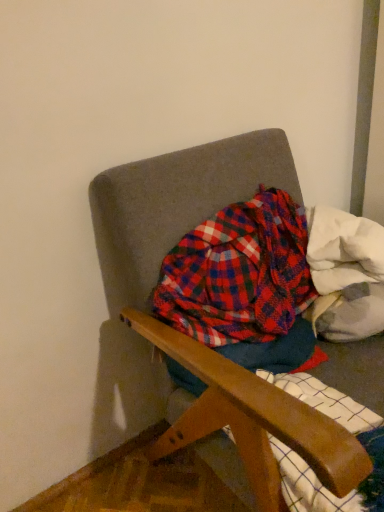
What do you see at coordinates (346, 274) in the screenshot?
I see `white fluffy blanket at upper right` at bounding box center [346, 274].

Where is `white fluffy blanket at upper right`? The height and width of the screenshot is (512, 384). white fluffy blanket at upper right is located at coordinates (346, 274).

Relative to textured fabric chair at center, is plaid fabric at center in front or behind?

Visually, plaid fabric at center is located behind textured fabric chair at center.

From the image's perspective, which one is positioned higher, plaid fabric at center or textured fabric chair at center?

plaid fabric at center, from the image's perspective.

Is plaid fabric at center bigger or smaller than textured fabric chair at center?

In the image, plaid fabric at center appears to be smaller than textured fabric chair at center.

Can you tell me how much plaid fabric at center and textured fabric chair at center differ in facing direction?

4.07 degrees separate the facing orientations of plaid fabric at center and textured fabric chair at center.

From a real-world perspective, is textured fabric chair at center on top of white fluffy blanket at upper right?

No, from a real-world perspective, textured fabric chair at center is not on top of white fluffy blanket at upper right.

Is there a large distance between textured fabric chair at center and white fluffy blanket at upper right?

No, there isn't a large distance between textured fabric chair at center and white fluffy blanket at upper right.

What's the angular difference between textured fabric chair at center and white fluffy blanket at upper right's facing directions?

The angular difference between textured fabric chair at center and white fluffy blanket at upper right is 48.2 degrees.

Is textured fabric chair at center oriented towards white fluffy blanket at upper right?

No, textured fabric chair at center does not turn towards white fluffy blanket at upper right.

This screenshot has height=512, width=384. I want to click on chair to the left of white fluffy blanket at upper right, so click(x=171, y=233).

Is white fluffy blanket at upper right inside the boundaries of textured fabric chair at center, or outside?

white fluffy blanket at upper right is spatially positioned inside textured fabric chair at center.

From the picture: Does white fluffy blanket at upper right turn towards textured fabric chair at center?

Yes, white fluffy blanket at upper right is aimed at textured fabric chair at center.

Is point (356, 335) farther from camera compared to point (197, 335)?

That is True.

From a real-world perspective, between white fluffy blanket at upper right and plaid fabric at center, who is vertically lower?

plaid fabric at center, from a real-world perspective.

Considering the sizes of textured fabric chair at center and plaid fabric at center in the image, is textured fabric chair at center wider or thinner than plaid fabric at center?

Clearly, textured fabric chair at center has more width compared to plaid fabric at center.

Which is in front, point (125, 288) or point (270, 295)?

Point (125, 288)

Is textured fabric chair at center surrounding plaid fabric at center?

Absolutely, plaid fabric at center is inside textured fabric chair at center.

Is plaid fabric at center not inside white fluffy blanket at upper right?

That's correct, plaid fabric at center is outside of white fluffy blanket at upper right.

From the image's perspective, would you say plaid fabric at center is shown under white fluffy blanket at upper right?

Correct, plaid fabric at center appears lower than white fluffy blanket at upper right in the image.

Who is bigger, plaid fabric at center or white fluffy blanket at upper right?

plaid fabric at center.

Which point is more distant from viewer, (254, 218) or (350, 273)?

Point (254, 218)

At what (x,y) coordinates should I click in order to perform the action: click on flannel above the textured fabric chair at center (from the image's perspective). Please return your answer as a coordinate pair (x, y). This screenshot has width=384, height=512. Looking at the image, I should click on (238, 273).

Image resolution: width=384 pixels, height=512 pixels. I want to click on chair located below the white fluffy blanket at upper right (from the image's perspective), so click(171, 233).

From the image, which object appears to be farther from white fluffy blanket at upper right, textured fabric chair at center or plaid fabric at center?

The object further to white fluffy blanket at upper right is textured fabric chair at center.

Based on the photo, when comparing their distances from white fluffy blanket at upper right, does plaid fabric at center or textured fabric chair at center seem closer?

plaid fabric at center lies closer to white fluffy blanket at upper right than the other object.

Looking at the image, which one is located closer to textured fabric chair at center, white fluffy blanket at upper right or plaid fabric at center?

Among the two, plaid fabric at center is located nearer to textured fabric chair at center.

When comparing their distances from textured fabric chair at center, does plaid fabric at center or white fluffy blanket at upper right seem further?

The object further to textured fabric chair at center is white fluffy blanket at upper right.

Based on their spatial positions, is white fluffy blanket at upper right or textured fabric chair at center closer to plaid fabric at center?

The object closer to plaid fabric at center is white fluffy blanket at upper right.

Considering their positions, is textured fabric chair at center positioned further to plaid fabric at center than white fluffy blanket at upper right?

Based on the image, textured fabric chair at center appears to be further to plaid fabric at center.

This screenshot has height=512, width=384. Identify the location of flannel between textured fabric chair at center and white fluffy blanket at upper right in the front-back direction. (238, 273).